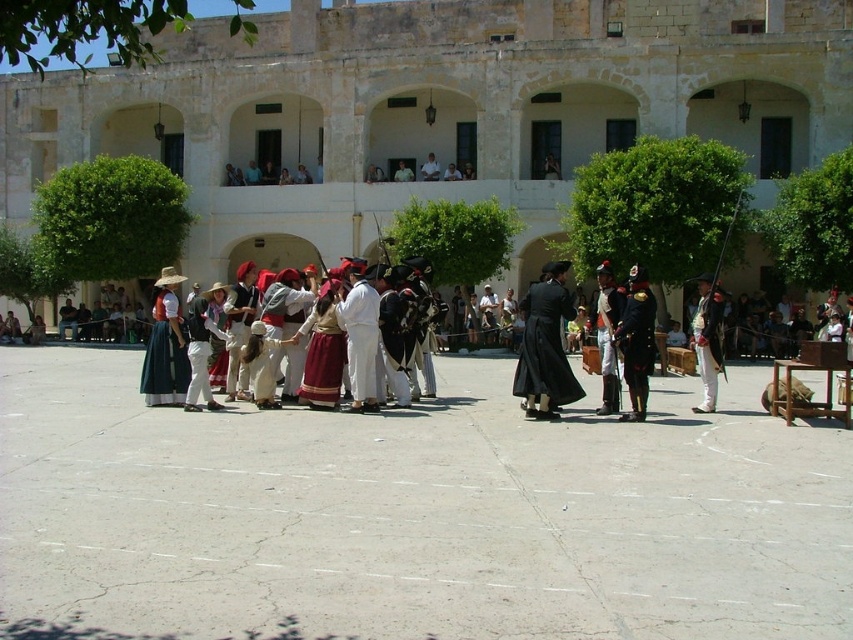
You are standing in front of the beige stone building at center and want to locate the point at coordinates (434, 108). Where on the building would this point be located?

The point at coordinates (434, 108) is located on the beige stone building at center.